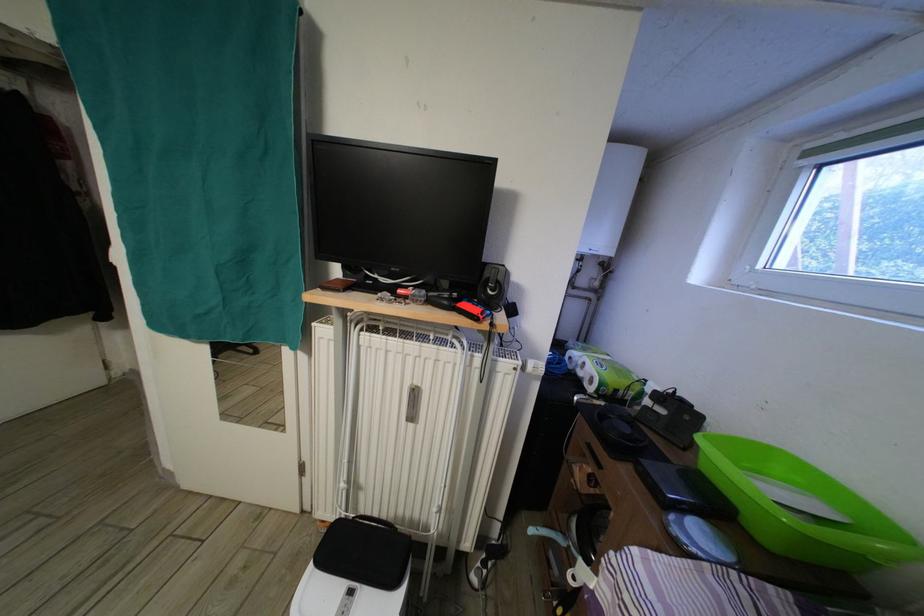
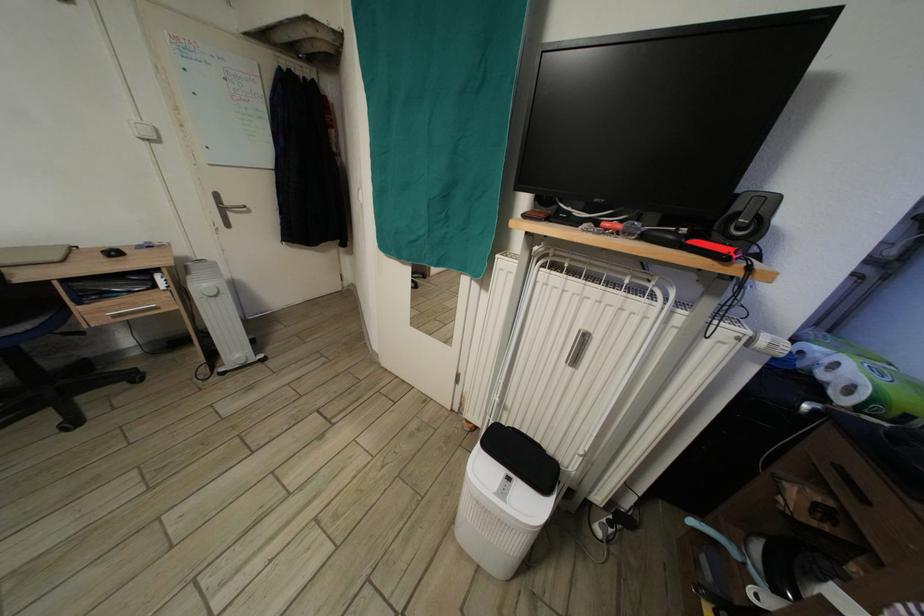
Where in the second image is the point corresponding to [578,363] from the first image?

(808, 359)